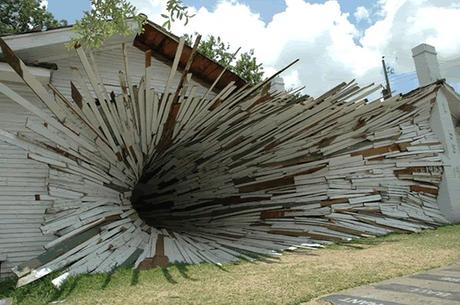
Locate an element on the screen. This screenshot has height=305, width=460. cable is located at coordinates (404, 72).